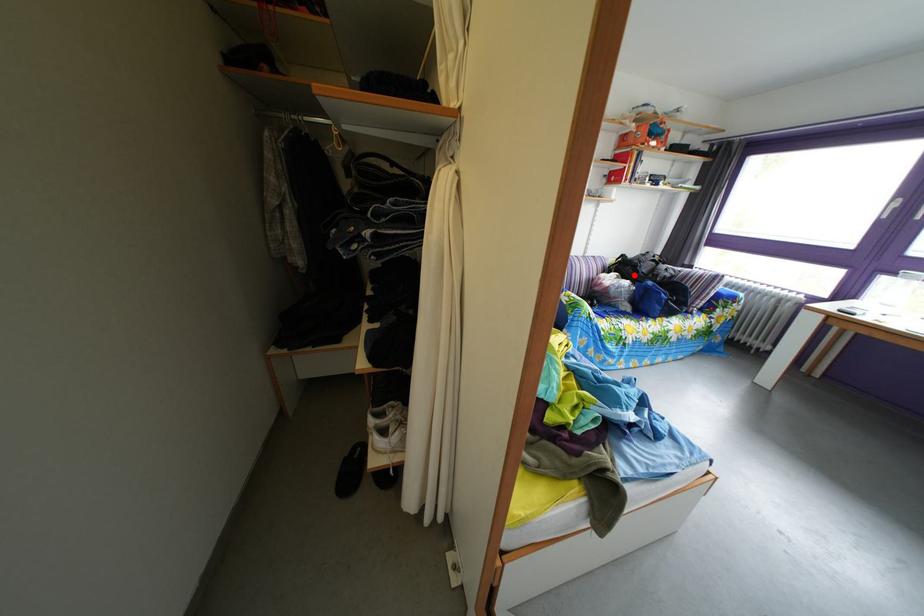
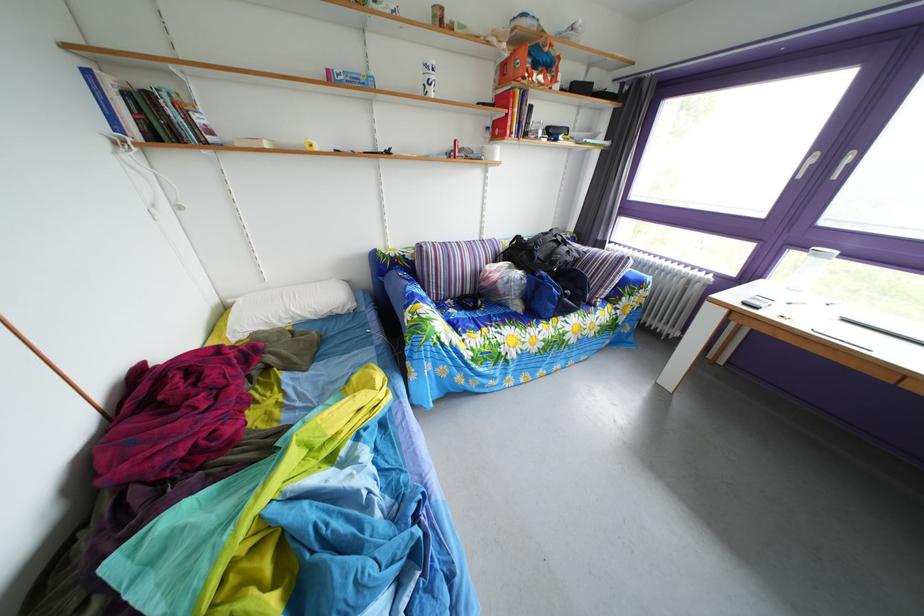
Find the pixel in the second image that matches the highlighted location in the first image.

(529, 261)